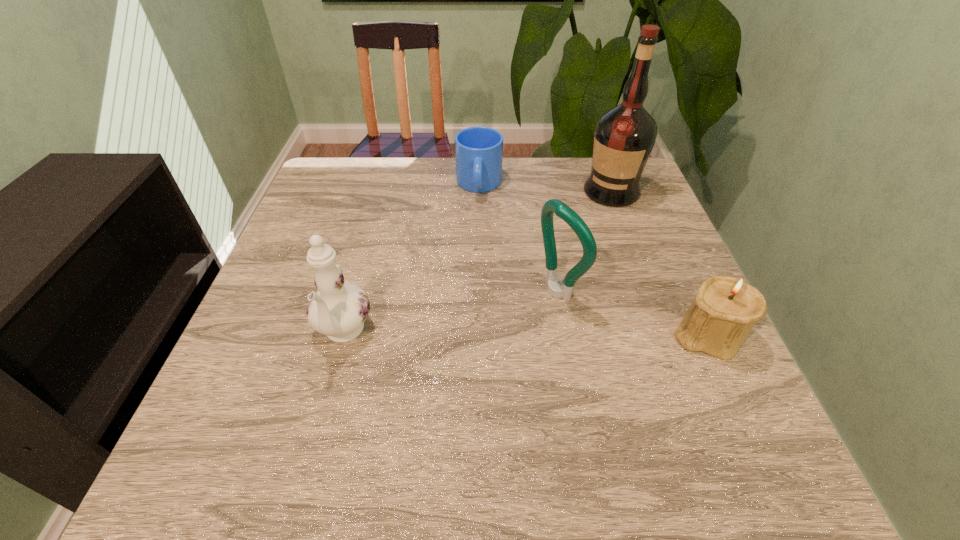
Identify the location of free space that satisfies the following two spatial constraints: 1. on the front side of the liquor; 2. on the right side of the second shortest object. This screenshot has width=960, height=540. (663, 335).